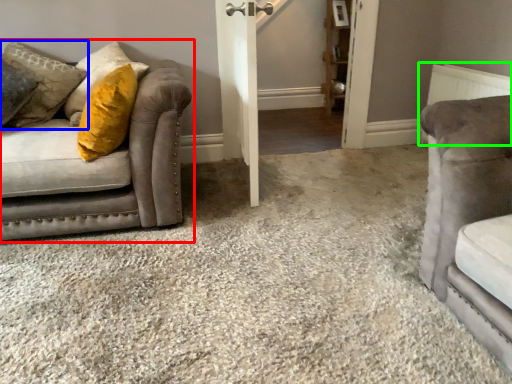
Question: Estimate the real-world distances between objects in this image. Which object is closer to studio couch (highlighted by a red box), pillow (highlighted by a blue box) or radiator (highlighted by a green box)?

Choices:
 (A) pillow
 (B) radiator

Answer: (A)